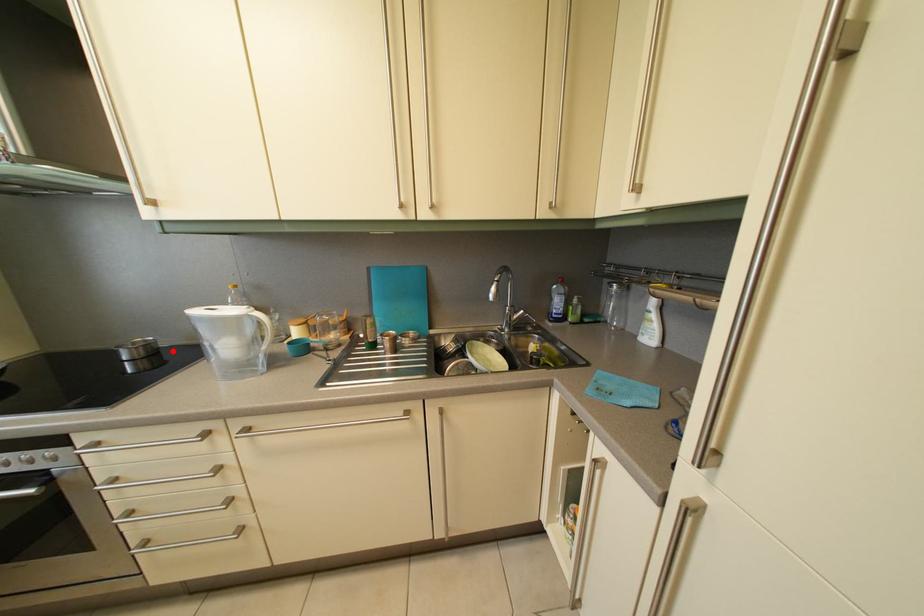
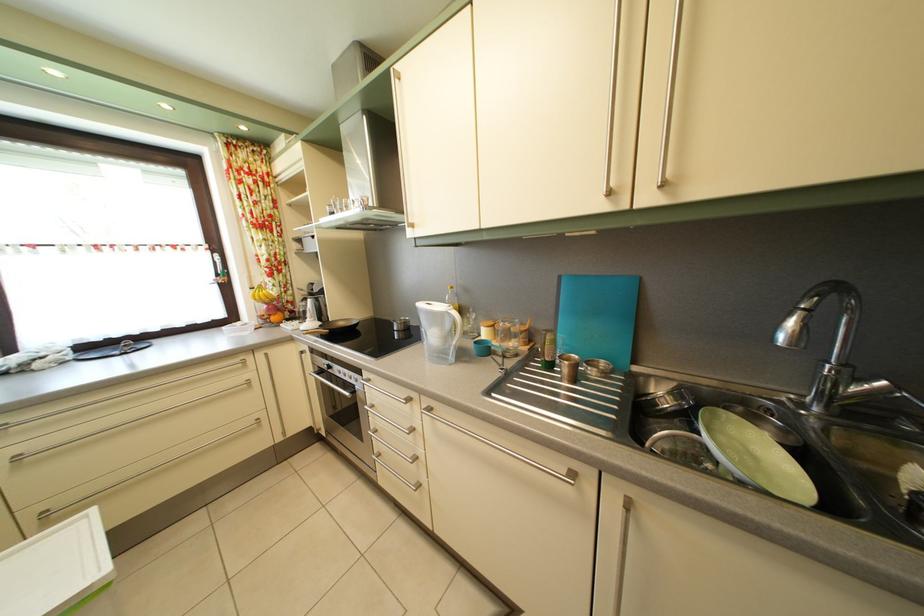
Question: A red point is marked in image1. In image2, is the corresponding 3D point closer to the camera or farther? Reply with the corresponding letter.

Choices:
 (A) The corresponding 3D point is closer.
 (B) The corresponding 3D point is farther.

Answer: (B)